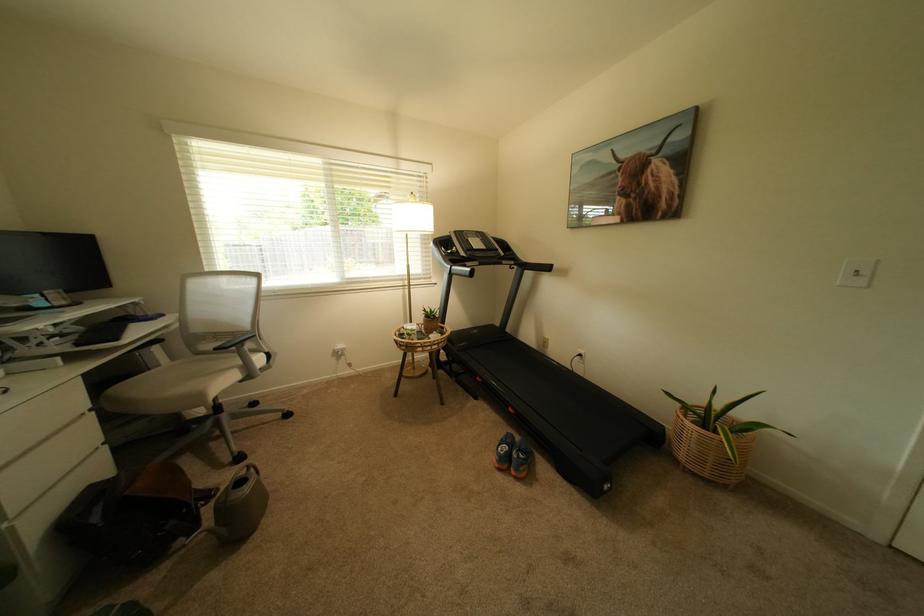
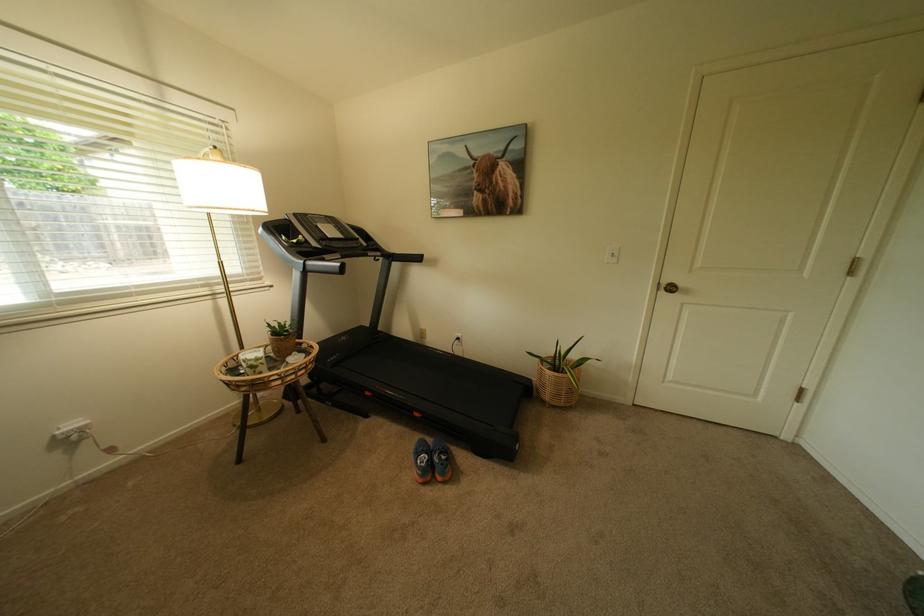
Question: Based on the continuous images, in which direction is the camera rotating? Reply with the corresponding letter.

Choices:
 (A) Left
 (B) Right
 (C) Up
 (D) Down

Answer: (B)